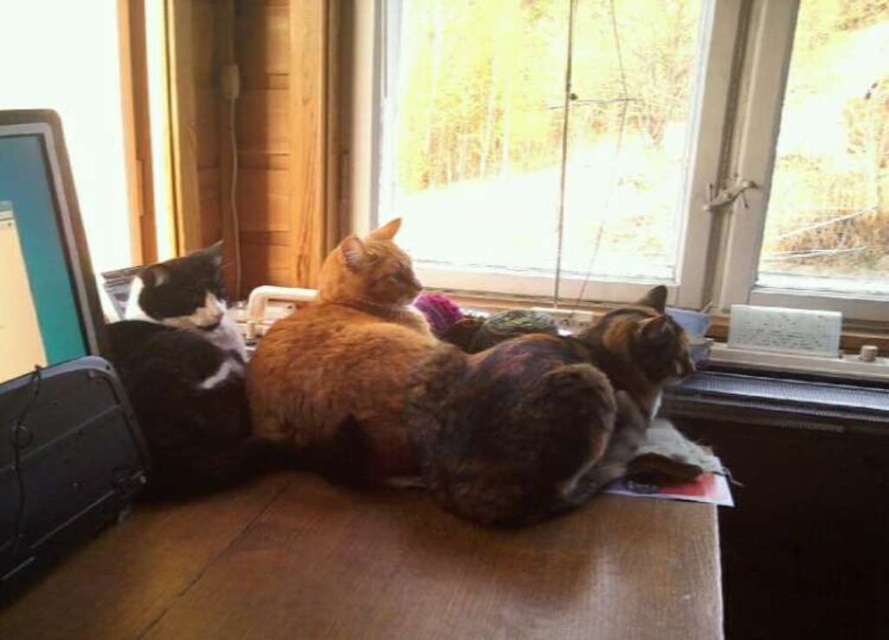
Question: Does black glossy monitor at left appear over golden fur cat at center?

Choices:
 (A) yes
 (B) no

Answer: (B)

Question: Estimate the real-world distances between objects in this image. Which object is closer to the transparent glass window at center?

Choices:
 (A) matte black monitor at left
 (B) brown wooden table at lower center
 (C) golden fur cat at center

Answer: (C)

Question: Which point is farther from the camera taking this photo?

Choices:
 (A) coord(29,252)
 (B) coord(322,412)
 (C) coord(419,618)
 (D) coord(663,88)

Answer: (D)

Question: Does transparent glass window at center appear on the left side of black glossy monitor at left?

Choices:
 (A) yes
 (B) no

Answer: (B)

Question: Can you confirm if brown wooden table at lower center is smaller than matte black monitor at left?

Choices:
 (A) yes
 (B) no

Answer: (B)

Question: Which is nearer to the black glossy monitor at left?

Choices:
 (A) multicolored fur cat at center
 (B) transparent glass window at center
 (C) black and white fur cat at left

Answer: (C)